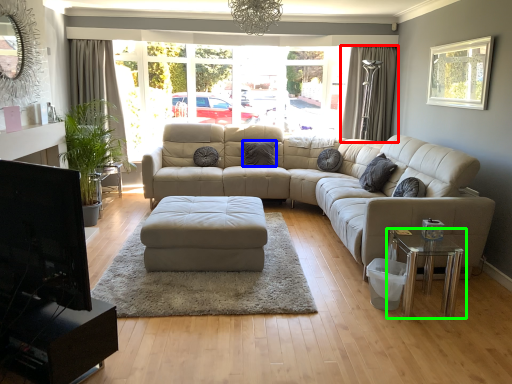
Question: Based on their relative distances, which object is nearer to curtain (highlighted by a red box)? Choose from pillow (highlighted by a blue box) and table (highlighted by a green box).

Choices:
 (A) pillow
 (B) table

Answer: (A)